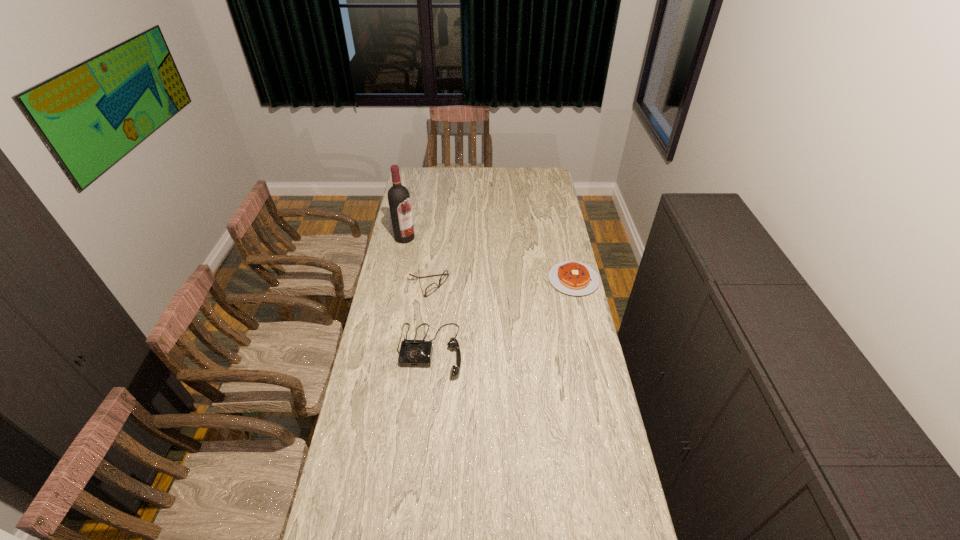
Image resolution: width=960 pixels, height=540 pixels. What are the coordinates of `the nearest object` in the screenshot? It's located at (413, 353).

At what (x,y) coordinates should I click in order to perform the action: click on telephone. Please return your answer as a coordinate pair (x, y). This screenshot has height=540, width=960. Looking at the image, I should click on (413, 353).

At what (x,y) coordinates should I click in order to perform the action: click on the rightmost object. Please return your answer as a coordinate pair (x, y). Image resolution: width=960 pixels, height=540 pixels. Looking at the image, I should click on (575, 278).

Locate an element on the screen. The width and height of the screenshot is (960, 540). spectacles is located at coordinates (433, 287).

You are a GUI agent. You are given a task and a screenshot of the screen. Output one action in this format:
    pyautogui.click(x=<x>, y=<y>)
    Task: Click on the wine bottle
    Image resolution: width=960 pixels, height=540 pixels.
    Given the screenshot: What is the action you would take?
    pos(398,195)

At what (x,y) coordinates should I click in order to perform the action: click on the farthest object. Please return your answer as a coordinate pair (x, y). The image size is (960, 540). Looking at the image, I should click on (398, 195).

At what (x,y) coordinates should I click in order to perform the action: click on free location located on the dial of the telephone. Please return your answer as a coordinate pair (x, y). Image resolution: width=960 pixels, height=540 pixels. Looking at the image, I should click on (420, 440).

What are the coordinates of `vacant space located on the back of the pancake` in the screenshot? It's located at (563, 230).

The height and width of the screenshot is (540, 960). I want to click on vacant area situated on the front-facing side of the spectacles, so click(499, 319).

Locate an element on the screen. The width and height of the screenshot is (960, 540). vacant area situated on the front-facing side of the spectacles is located at coordinates (463, 301).